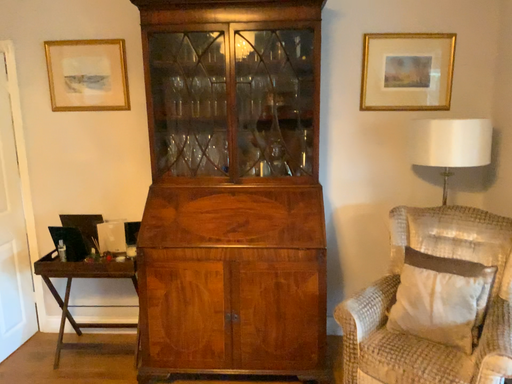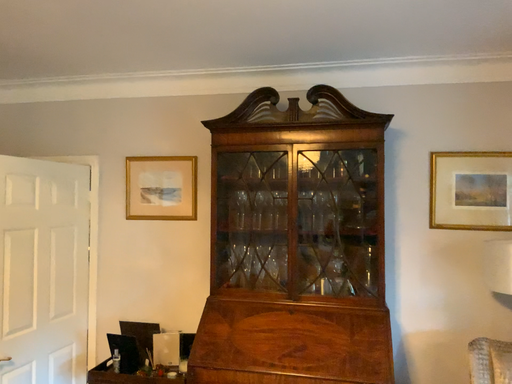
Question: How did the camera likely rotate when shooting the video?

Choices:
 (A) rotated right
 (B) rotated left

Answer: (B)